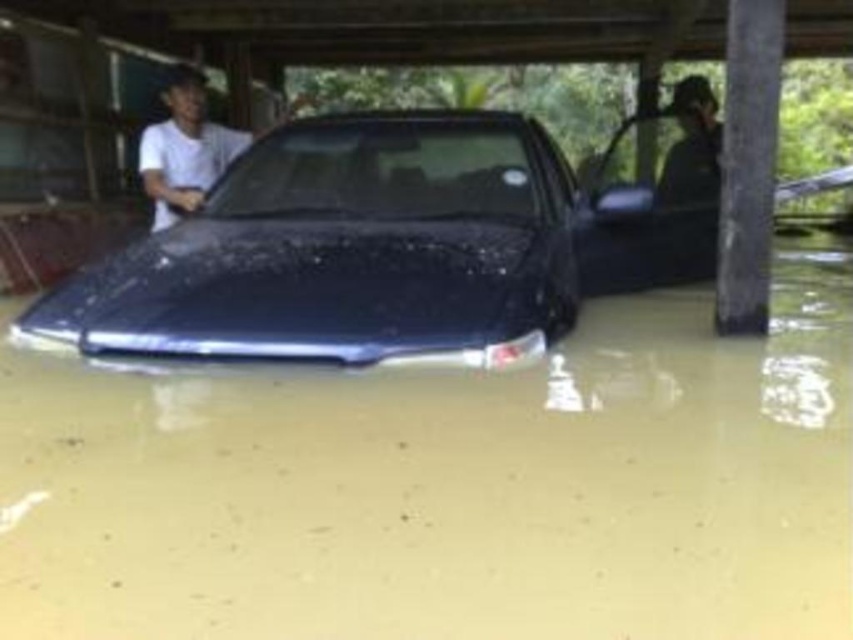
You are a rescue worker assessing the flooded area. You see the clear water at car front and the white matte shirt at center. Which object is taller?

The white matte shirt at center is taller than the clear water at car front.

You are a rescue worker assessing the flooded area. You see the clear water at car front and the white matte shirt at center. Which object takes up more space in the image?

The clear water at car front has a larger size compared to the white matte shirt at center, so it takes up more space in the image.